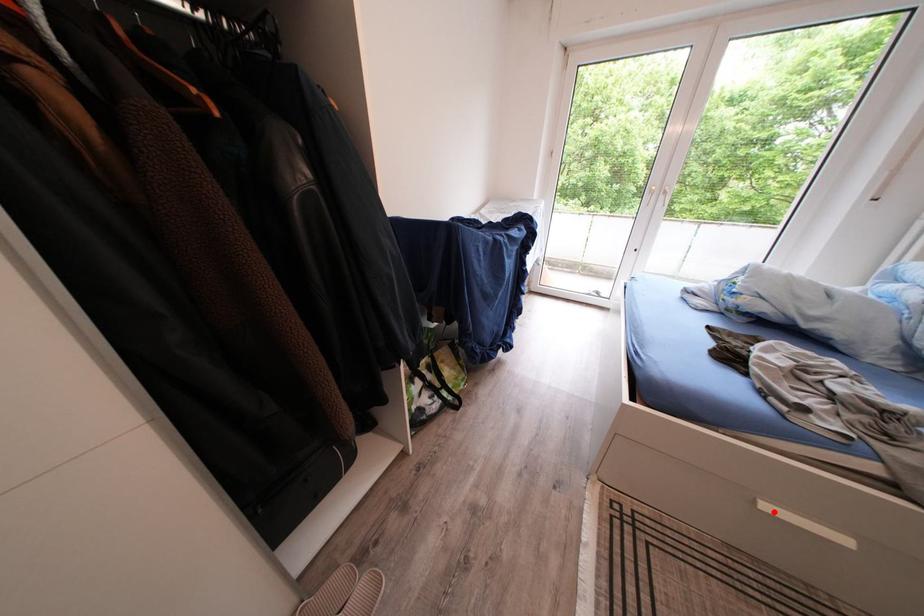
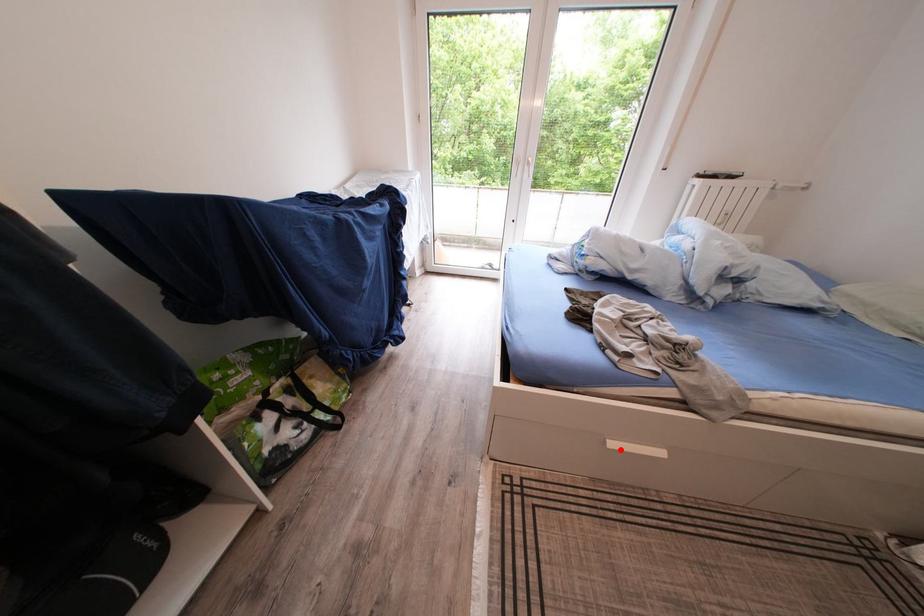
I am providing you with two images of the same scene from different viewpoints. A red point is marked on the first image and another point is marked on the second image. Is the red point in image1 aligned with the point shown in image2?

Yes